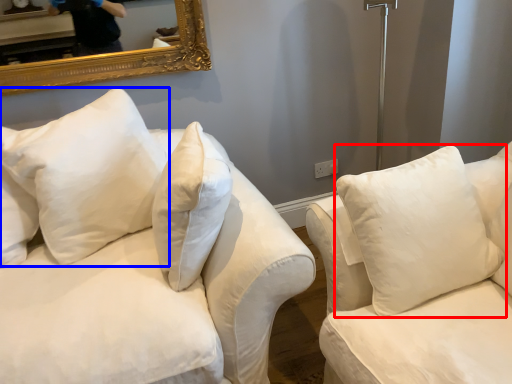
Question: Which object is closer to the camera taking this photo, pillow (highlighted by a red box) or pillow (highlighted by a blue box)?

Choices:
 (A) pillow
 (B) pillow

Answer: (A)